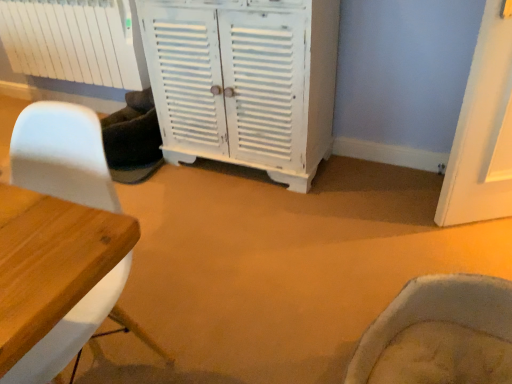
This screenshot has width=512, height=384. Describe the element at coordinates (74, 41) in the screenshot. I see `white matte radiator at upper left` at that location.

What is the approximate width of white matte chair at left?

white matte chair at left is 20.22 inches wide.

Image resolution: width=512 pixels, height=384 pixels. Describe the element at coordinates (244, 81) in the screenshot. I see `white painted wood cabinet at center` at that location.

This screenshot has width=512, height=384. Identify the location of white matte radiator at upper left. (74, 41).

Is white painted wood cabinet at center looking in the opposite direction of white matte radiator at upper left?

That's not correct — white painted wood cabinet at center is not looking away from white matte radiator at upper left.

Is white painted wood cabinet at center bigger or smaller than white matte radiator at upper left?

In the image, white painted wood cabinet at center appears to be larger than white matte radiator at upper left.

From a real-world perspective, is white painted wood cabinet at center positioned above or below white matte radiator at upper left?

white painted wood cabinet at center is below white matte radiator at upper left.

Considering the relative sizes of white painted wood cabinet at center and white matte radiator at upper left in the image provided, is white painted wood cabinet at center wider than white matte radiator at upper left?

Yes, white painted wood cabinet at center is wider than white matte radiator at upper left.

Considering the positions of objects white matte radiator at upper left and white matte chair at left in the image provided, who is more to the right, white matte radiator at upper left or white matte chair at left?

From the viewer's perspective, white matte chair at left appears more on the right side.

Is the position of white matte radiator at upper left less distant than that of white matte chair at left?

No, the depth of white matte radiator at upper left is greater than that of white matte chair at left.

Would you say white matte chair at left is part of white matte radiator at upper left's contents?

Actually, white matte chair at left is outside white matte radiator at upper left.

Looking at their sizes, would you say white painted wood cabinet at center is wider or thinner than white matte chair at left?

In the image, white painted wood cabinet at center appears to be more narrow than white matte chair at left.

Does white painted wood cabinet at center have a smaller size compared to white matte chair at left?

No, white painted wood cabinet at center is not smaller than white matte chair at left.

Would you say white painted wood cabinet at center is a long distance from white matte chair at left?

Indeed, white painted wood cabinet at center is not near white matte chair at left.

Could white matte chair at left be considered to be inside white painted wood cabinet at center?

No, white matte chair at left is not inside white painted wood cabinet at center.

Which is more to the right, white matte radiator at upper left or white painted wood cabinet at center?

white painted wood cabinet at center is more to the right.

Would you say white matte radiator at upper left is a long distance from white painted wood cabinet at center?

No, white matte radiator at upper left is in close proximity to white painted wood cabinet at center.

From a real-world perspective, is white matte radiator at upper left physically above white painted wood cabinet at center?

Indeed, from a real-world perspective, white matte radiator at upper left stands above white painted wood cabinet at center.

Consider the image. How different are the orientations of white matte radiator at upper left and white painted wood cabinet at center in degrees?

The facing directions of white matte radiator at upper left and white painted wood cabinet at center are 1.3 degrees apart.

Which is nearer, [83,195] or [285,65]?

Point [83,195].

Relative to white painted wood cabinet at center, is white matte chair at left in front or behind?

white matte chair at left is in front of white painted wood cabinet at center.

From a real-world perspective, is white matte chair at left beneath white painted wood cabinet at center?

Yes, from a real-world perspective, white matte chair at left is under white painted wood cabinet at center.

Do you think white matte chair at left is within white painted wood cabinet at center, or outside of it?

white matte chair at left is outside white painted wood cabinet at center.

Is white matte chair at left surrounding white matte radiator at upper left?

No, white matte radiator at upper left is not inside white matte chair at left.

Between white matte chair at left and white matte radiator at upper left, which one has more height?

Standing taller between the two is white matte chair at left.

Which is less distant, (102, 287) or (108, 1)?

Positioned in front is point (102, 287).

You are a GUI agent. You are given a task and a screenshot of the screen. Output one action in this format:
    pyautogui.click(x=<x>, y=<y>)
    Task: Click on the chair below the white matte radiator at upper left (from the image's perspective)
    
    Given the screenshot: What is the action you would take?
    (x=62, y=155)

Where is `cabinetry lying in front of the white matte radiator at upper left`? This screenshot has width=512, height=384. cabinetry lying in front of the white matte radiator at upper left is located at coordinates (244, 81).

Identify the location of radiator lying above the white matte chair at left (from the image's perspective). The height and width of the screenshot is (384, 512). (74, 41).

Considering their positions, is white painted wood cabinet at center positioned further to white matte radiator at upper left than white matte chair at left?

white matte chair at left is further to white matte radiator at upper left.

Considering their positions, is white matte chair at left positioned closer to white painted wood cabinet at center than white matte radiator at upper left?

The object closer to white painted wood cabinet at center is white matte radiator at upper left.

Considering their positions, is white matte radiator at upper left positioned closer to white matte chair at left than white painted wood cabinet at center?

white painted wood cabinet at center is closer to white matte chair at left.

Considering their positions, is white matte chair at left positioned closer to white matte radiator at upper left than white painted wood cabinet at center?

Among the two, white painted wood cabinet at center is located nearer to white matte radiator at upper left.

From the picture: From the image, which object appears to be nearer to white painted wood cabinet at center, white matte radiator at upper left or white matte chair at left?

white matte radiator at upper left is closer to white painted wood cabinet at center.

Looking at the image, which one is located further to white matte chair at left, white painted wood cabinet at center or white matte radiator at upper left?

white matte radiator at upper left is further to white matte chair at left.

At what (x,y) coordinates should I click in order to perform the action: click on cabinetry located between white matte chair at left and white matte radiator at upper left in the depth direction. Please return your answer as a coordinate pair (x, y). This screenshot has width=512, height=384. Looking at the image, I should click on (244, 81).